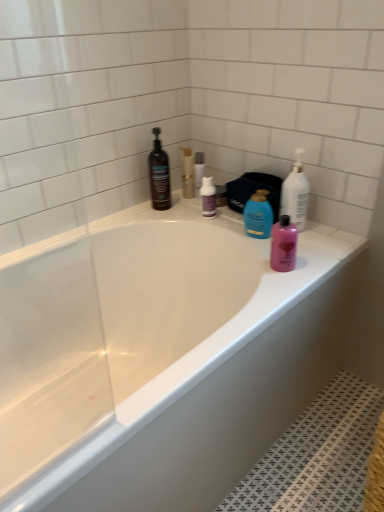
Question: Is point (248, 230) positioned closer to the camera than point (183, 175)?

Choices:
 (A) farther
 (B) closer

Answer: (B)

Question: Is blue glossy bottle at upper center, the second cleaning product when ordered from right to left, inside or outside of gold metallic soap dispenser at upper center, marked as the third toiletry in a front-to-back arrangement?

Choices:
 (A) inside
 (B) outside

Answer: (B)

Question: Which of these objects is positioned farthest from the white glossy bathtub at upper center?

Choices:
 (A) pink glossy bottle at right, the third toiletry from the back
 (B) white glossy bottle at upper right, which ranks as the first cleaning product in right-to-left order
 (C) gold metallic soap dispenser at upper center, marked as the third toiletry in a front-to-back arrangement
 (D) purple matte bottle at center, which is the 2th cleaning product in left-to-right order
 (E) clear plastic bottle at upper center, which is the 2th toiletry in right-to-left order

Answer: (E)

Question: Considering the real-world distances, which object is closest to the blue glossy bottle at upper center, the second cleaning product when ordered from right to left?

Choices:
 (A) gold metallic soap dispenser at upper center, which is counted as the first toiletry, starting from the top
 (B) clear plastic bottle at upper center, which is the 2th toiletry in right-to-left order
 (C) pink glossy bottle at right, which ranks as the 3th toiletry in top-to-bottom order
 (D) white glossy bathtub at upper center
 (E) white glossy bottle at upper right, which ranks as the first cleaning product in right-to-left order

Answer: (E)